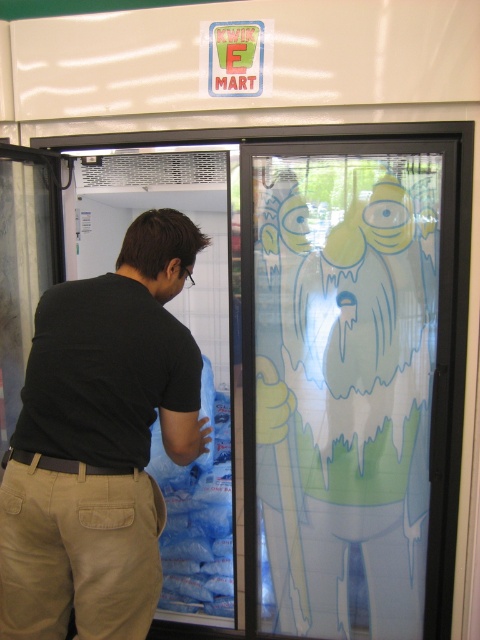
From the picture: Who is higher up, transparent plastic screen door at right or khaki cotton pants at lower left?

transparent plastic screen door at right is higher up.

Which is more to the left, transparent plastic screen door at right or khaki cotton pants at lower left?

Positioned to the left is khaki cotton pants at lower left.

Which is behind, point (277, 296) or point (86, 554)?

Positioned behind is point (277, 296).

This screenshot has width=480, height=640. I want to click on transparent plastic screen door at right, so click(352, 381).

The height and width of the screenshot is (640, 480). Identify the location of black matte shirt at center. (99, 442).

Can you confirm if black matte shirt at center is positioned to the right of khaki cotton pants at lower left?

Indeed, black matte shirt at center is positioned on the right side of khaki cotton pants at lower left.

Which is in front, point (203, 246) or point (79, 493)?

Positioned in front is point (79, 493).

Where is `black matte shirt at center`? black matte shirt at center is located at coordinates (99, 442).

Is transparent plastic screen door at right bigger than black matte shirt at center?

Yes, transparent plastic screen door at right is bigger than black matte shirt at center.

Which is in front, point (405, 481) or point (91, 324)?

Point (91, 324) is in front.

Where is `transparent plastic screen door at right`? transparent plastic screen door at right is located at coordinates (352, 381).